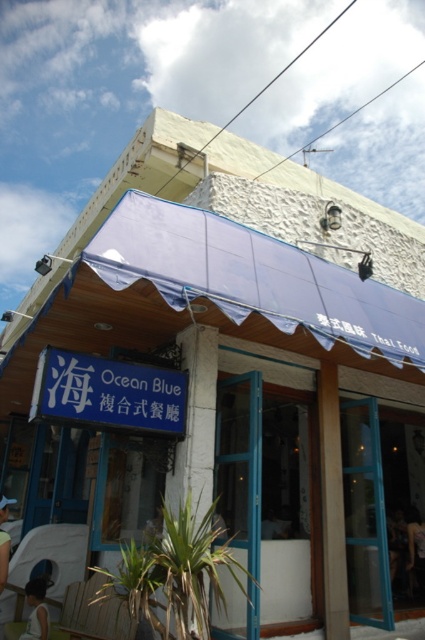
Question: Does transparent fabric canopy at center lie in front of light blue fabric at lower left?

Choices:
 (A) yes
 (B) no

Answer: (A)

Question: Considering the real-world distances, which object is closest to the light skin human at lower left?

Choices:
 (A) dark blue fabric shirt at lower right
 (B) transparent fabric canopy at center
 (C) light blue fabric at lower left

Answer: (C)

Question: Which object is the closest to the transparent fabric canopy at center?

Choices:
 (A) light blue fabric at lower left
 (B) dark blue fabric shirt at lower right

Answer: (A)

Question: Considering the relative positions of dark blue fabric shirt at lower right and light blue fabric at lower left in the image provided, where is dark blue fabric shirt at lower right located with respect to light blue fabric at lower left?

Choices:
 (A) below
 (B) above

Answer: (A)

Question: Based on their relative distances, which object is nearer to the dark blue fabric shirt at lower right?

Choices:
 (A) light blue fabric at lower left
 (B) light skin human at lower left

Answer: (B)

Question: Is the position of transparent fabric canopy at center less distant than that of light blue fabric at lower left?

Choices:
 (A) yes
 (B) no

Answer: (A)